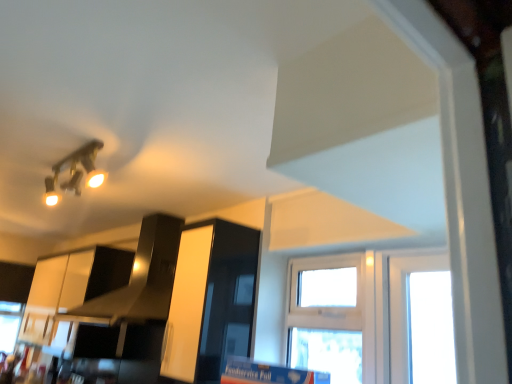
Question: Considering the relative sizes of glossy white cabinet at center and black glossy exhaust hood at upper center in the image provided, is glossy white cabinet at center smaller than black glossy exhaust hood at upper center?

Choices:
 (A) no
 (B) yes

Answer: (B)

Question: Does glossy white cabinet at center lie in front of black glossy exhaust hood at upper center?

Choices:
 (A) yes
 (B) no

Answer: (A)

Question: From the image's perspective, is glossy white cabinet at center located beneath black glossy exhaust hood at upper center?

Choices:
 (A) no
 (B) yes

Answer: (B)

Question: From a real-world perspective, does glossy white cabinet at center sit lower than black glossy exhaust hood at upper center?

Choices:
 (A) no
 (B) yes

Answer: (B)

Question: Considering the relative positions of glossy white cabinet at center and black glossy exhaust hood at upper center in the image provided, is glossy white cabinet at center to the left of black glossy exhaust hood at upper center from the viewer's perspective?

Choices:
 (A) no
 (B) yes

Answer: (A)

Question: Is glossy white cabinet at center aimed at black glossy exhaust hood at upper center?

Choices:
 (A) yes
 (B) no

Answer: (B)

Question: Can you confirm if white plastic window at center is wider than black glossy exhaust hood at upper center?

Choices:
 (A) no
 (B) yes

Answer: (A)

Question: Is white plastic window at center facing towards black glossy exhaust hood at upper center?

Choices:
 (A) yes
 (B) no

Answer: (B)

Question: Considering the relative sizes of white plastic window at center and black glossy exhaust hood at upper center in the image provided, is white plastic window at center shorter than black glossy exhaust hood at upper center?

Choices:
 (A) no
 (B) yes

Answer: (B)

Question: Is white plastic window at center at the right side of black glossy exhaust hood at upper center?

Choices:
 (A) no
 (B) yes

Answer: (B)

Question: Is white plastic window at center thinner than black glossy exhaust hood at upper center?

Choices:
 (A) yes
 (B) no

Answer: (A)

Question: From a real-world perspective, is white plastic window at center beneath black glossy exhaust hood at upper center?

Choices:
 (A) no
 (B) yes

Answer: (B)

Question: Is black glossy exhaust hood at upper center at the right side of white plastic window at center?

Choices:
 (A) yes
 (B) no

Answer: (B)